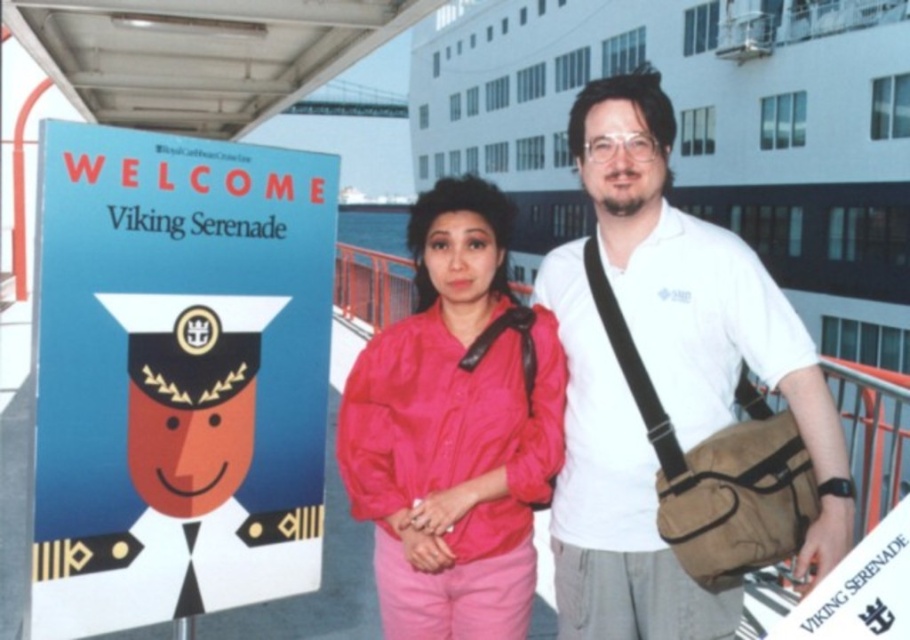
In the scene shown: Is blue paper sign at upper left smaller than white cotton shirt at center?

Yes, blue paper sign at upper left is smaller than white cotton shirt at center.

Does point (160, 480) lie in front of point (659, 609)?

Yes, point (160, 480) is in front of point (659, 609).

The width and height of the screenshot is (910, 640). I want to click on blue paper sign at upper left, so click(x=177, y=376).

Does point (711, 236) come closer to viewer compared to point (504, 458)?

No, (711, 236) is further to viewer.

Based on the photo, can you confirm if white cotton shirt at center is thinner than matte pink jacket at center?

No, white cotton shirt at center is not thinner than matte pink jacket at center.

What do you see at coordinates (700, 298) in the screenshot? This screenshot has height=640, width=910. I see `white cotton shirt at center` at bounding box center [700, 298].

The width and height of the screenshot is (910, 640). I want to click on white cotton shirt at center, so click(x=700, y=298).

Identify the location of blue paper sign at upper left. (177, 376).

Which is more to the right, blue paper sign at upper left or matte pink jacket at center?

matte pink jacket at center

The image size is (910, 640). I want to click on blue paper sign at upper left, so click(x=177, y=376).

This screenshot has height=640, width=910. What are the coordinates of `blue paper sign at upper left` in the screenshot? It's located at (177, 376).